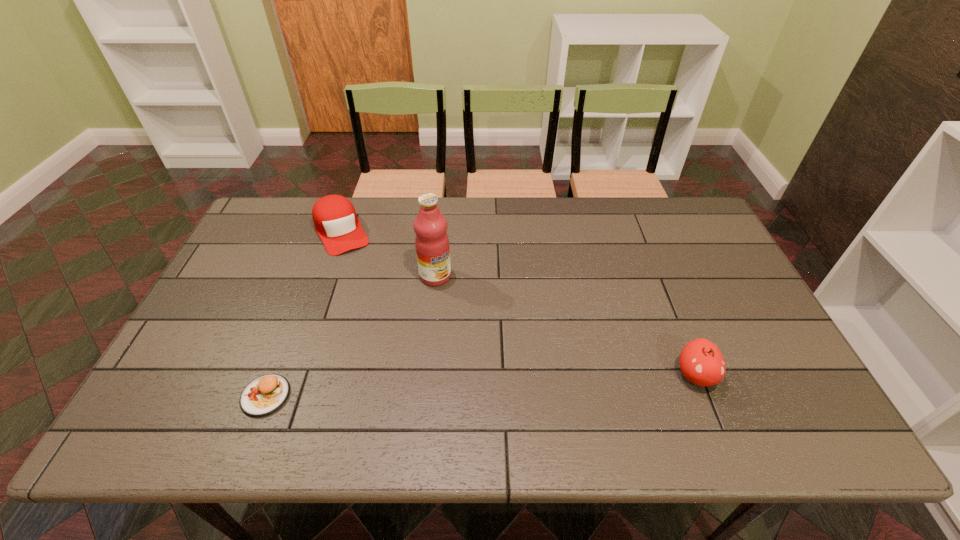
In the image, there is a desktop. In order to click on vacant space at the far right corner in this screenshot , I will do `click(660, 230)`.

The width and height of the screenshot is (960, 540). Identify the location of vacant area that lies between the patty and the farthest object. (304, 314).

The image size is (960, 540). In order to click on blank region between the fruit juice and the rightmost object in this screenshot , I will do `click(565, 326)`.

The width and height of the screenshot is (960, 540). Identify the location of free space between the patty and the farthest object. (304, 314).

The width and height of the screenshot is (960, 540). Find the location of `free area in between the tallest object and the baseball cap`. free area in between the tallest object and the baseball cap is located at coordinates (389, 254).

The width and height of the screenshot is (960, 540). I want to click on free area in between the baseball cap and the apple, so [x=518, y=303].

Find the location of `vacant area that lies between the second object from right to left and the farthest object`. vacant area that lies between the second object from right to left and the farthest object is located at coordinates (389, 254).

Image resolution: width=960 pixels, height=540 pixels. In order to click on free spot between the rightmost object and the farthest object in this screenshot , I will do `click(518, 303)`.

Identify the location of free spot between the shortest object and the rightmost object. The image size is (960, 540). (481, 386).

You are a GUI agent. You are given a task and a screenshot of the screen. Output one action in this format:
    pyautogui.click(x=<x>, y=<y>)
    Task: Click on the free space between the tallest object and the rightmost object
    This screenshot has height=540, width=960.
    Given the screenshot: What is the action you would take?
    pyautogui.click(x=565, y=326)